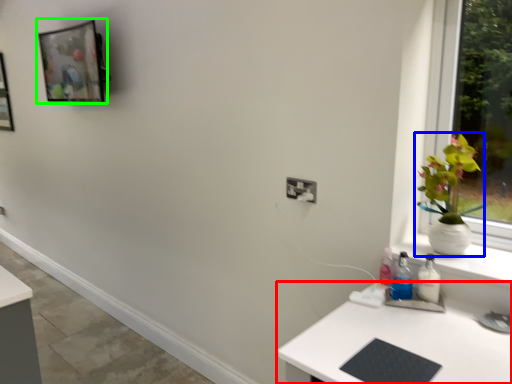
Question: Which object is positioned farthest from desk (highlighted by a red box)? Select from houseplant (highlighted by a blue box) and picture frame (highlighted by a green box).

Choices:
 (A) houseplant
 (B) picture frame

Answer: (B)